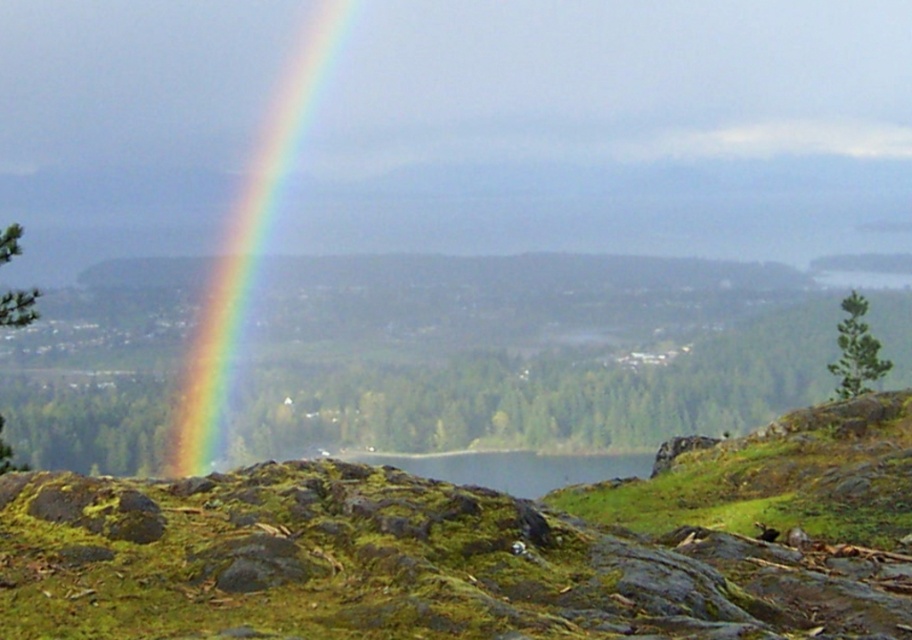
You are an artist trying to paint the scene. You notice the rainbow at left and the green mossy rock at center. Which object should you depict as taller in your painting?

The rainbow at left should be depicted as taller in the painting since it is much taller than the green mossy rock at center according to the description.

You are an artist trying to paint the scene. You want to ensure the rainbow at left and green mossy rock at center are proportionally accurate. Which object should you paint to be wider?

The green mossy rock at center should be painted wider because the rainbow at left is narrower than it.